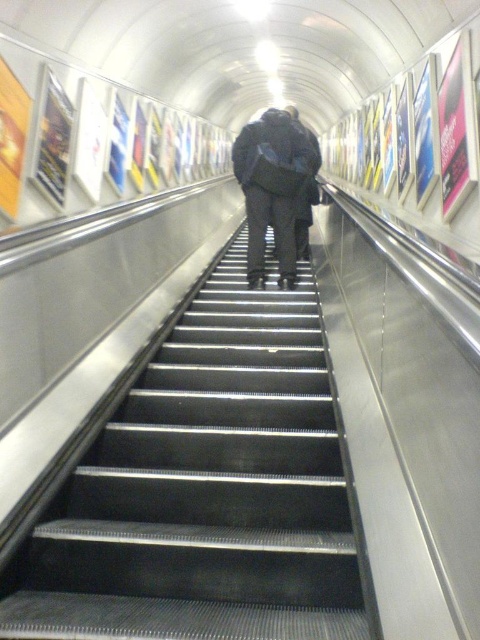
You are standing on the escalator and see the metallic gray stairs at center and the dark gray fabric backpack at center. Which object is closer to you?

The metallic gray stairs at center is closer to you because it is in front of the dark gray fabric backpack at center.

You are standing on the escalator and notice a dark gray fabric backpack at center. Where is the metallic gray stairs at center in relation to the backpack?

→ The metallic gray stairs at center is below the dark gray fabric backpack at center.

You are carrying a dark gray fabric backpack at center and want to place it on the metallic gray stairs at center. Can you fit the backpack on the stairs?

The metallic gray stairs at center might be wider than dark gray fabric backpack at center, so there is a possibility that the backpack will fit. However, since the exact dimensions are not provided, it is recommended to check the width of both the stairs and the backpack before placing it.